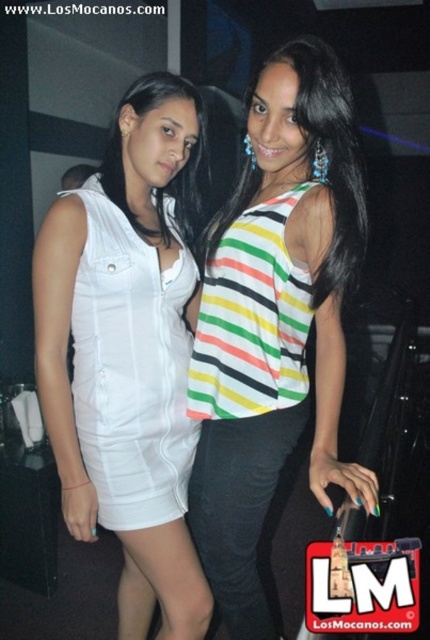
Does striped fabric top at center have a greater width compared to white satin dress at left?

Indeed, striped fabric top at center has a greater width compared to white satin dress at left.

Measure the distance between striped fabric top at center and camera.

striped fabric top at center and camera are 3.31 feet apart from each other.

From the picture: Who is more forward, (220, 298) or (137, 365)?

Point (220, 298)

Where is `striped fabric top at center`? The height and width of the screenshot is (640, 430). striped fabric top at center is located at coordinates (275, 323).

Is white matte dress at left smaller than striped fabric blouse at center?

No, white matte dress at left is not smaller than striped fabric blouse at center.

Who is more distant from viewer, (122, 484) or (307, 132)?

Point (122, 484)

This screenshot has height=640, width=430. Identify the location of white matte dress at left. (129, 356).

Is point (294, 419) more distant than point (163, 388)?

That is False.

Which is behind, point (313, 166) or point (123, 513)?

The point (123, 513) is behind.

Where is `striped fabric top at center`? striped fabric top at center is located at coordinates (275, 323).